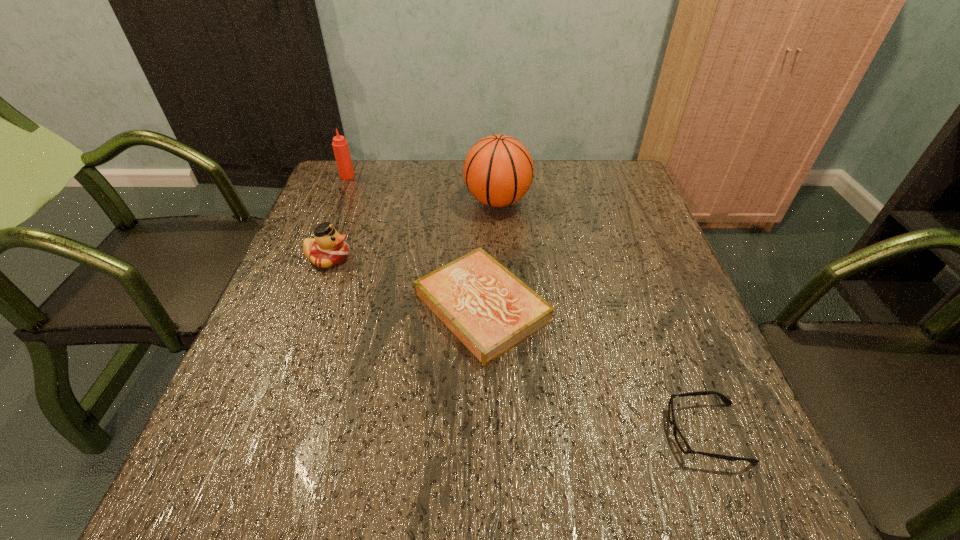
The height and width of the screenshot is (540, 960). Find the location of `vacant space located on the face of the duck`. vacant space located on the face of the duck is located at coordinates (372, 258).

Where is `vacant area situated on the left of the hardback book`? The width and height of the screenshot is (960, 540). vacant area situated on the left of the hardback book is located at coordinates (319, 307).

Find the location of a particular element. This screenshot has height=540, width=960. vacant area located on the front-facing side of the rightmost object is located at coordinates (597, 433).

I want to click on vacant region located on the front-facing side of the rightmost object, so click(x=501, y=433).

Where is `free space located on the front-facing side of the rightmost object`? The width and height of the screenshot is (960, 540). free space located on the front-facing side of the rightmost object is located at coordinates (429, 433).

Find the location of `basketball located at the far edge`. basketball located at the far edge is located at coordinates (498, 171).

Image resolution: width=960 pixels, height=540 pixels. Identify the location of Tabasco sauce located at the far edge. (340, 146).

I want to click on object that is at the near edge, so click(680, 440).

The image size is (960, 540). Find the location of `Tabasco sauce that is at the left edge`. Tabasco sauce that is at the left edge is located at coordinates (340, 146).

Identify the location of duck present at the left edge. (328, 248).